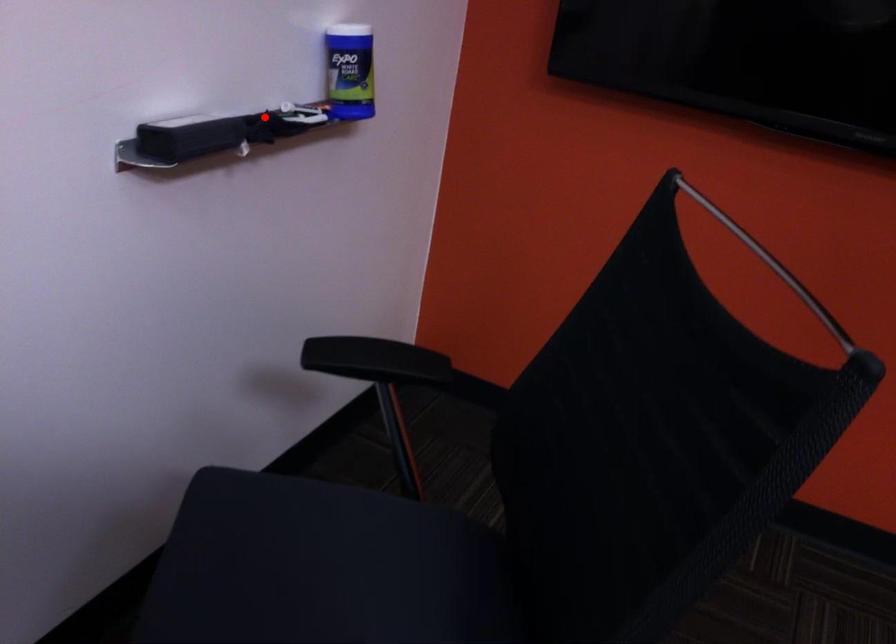
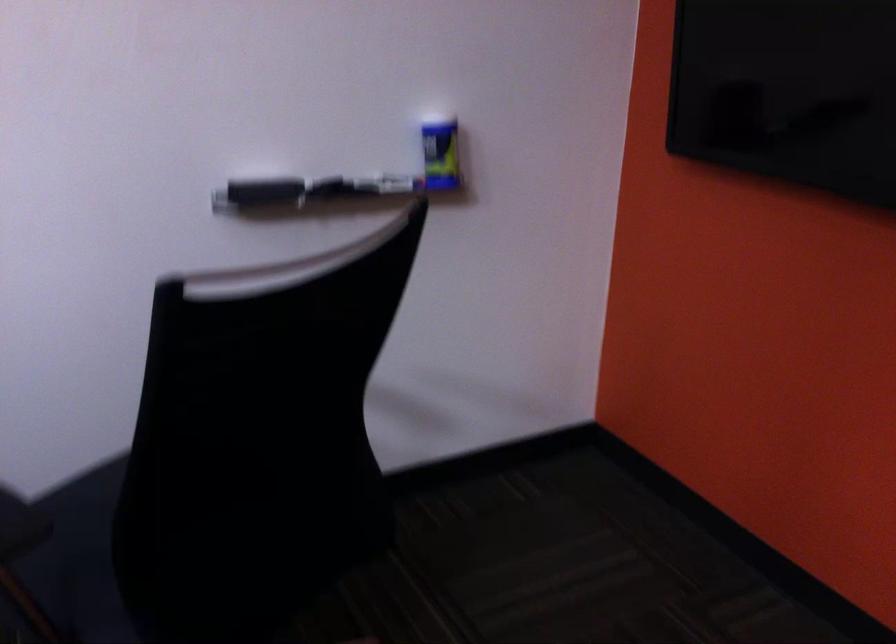
Find the pixel in the second image that matches the highlighted location in the first image.

(355, 181)